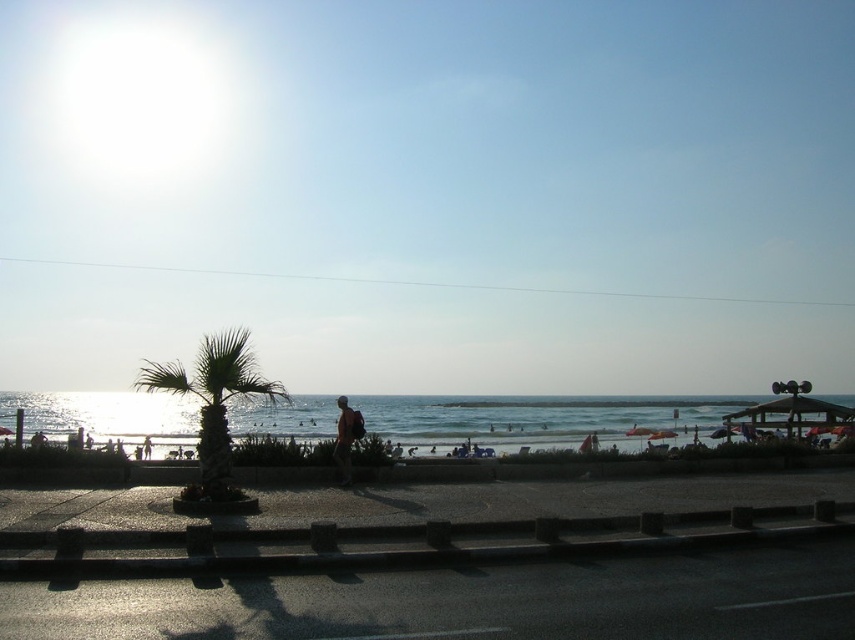
You are standing at the point marked by the coordinates point (429, 192) in the image. Looking around, you see the bright blue sky at upper center. Which direction should you face to avoid the glare of the sun, which is in the left portion of the frame?

The sun is in the left portion of the frame, so to avoid the glare, you should face away from the left direction. Facing towards the right or towards the beach area would reduce the glare from the sun.

You are a photographer trying to capture a sunset photo. You have a camera with a height limit of 1.8 meters. The green leafy palm tree at center and the tan fabric shirt at center are in your frame. Can you position your camera so that it doesn

The green leafy palm tree at center is taller than the tan fabric shirt at center. Since the palm tree is taller than 1.8 meters, positioning the camera below 1.8 meters may block the view of the palm tree. However, if the shirt is shorter than 1.8 meters, adjusting the angle could allow both to be in frame without obstruction. But since the exact heights aren